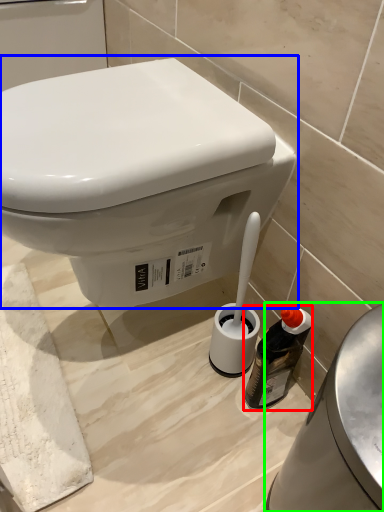
Question: Estimate the real-world distances between objects in this image. Which object is closer to bottle (highlighted by a red box), toilet (highlighted by a blue box) or porcelain (highlighted by a green box)?

Choices:
 (A) toilet
 (B) porcelain

Answer: (B)